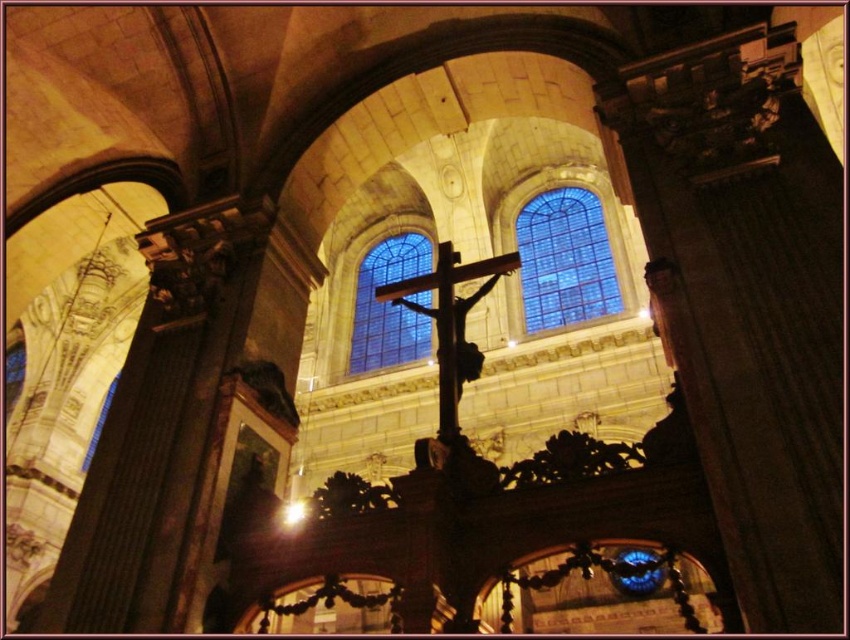
Question: Does blue stained glass at upper center appear on the right side of blue glass window at center?

Choices:
 (A) yes
 (B) no

Answer: (A)

Question: Can you confirm if blue stained glass at upper center is wider than metallic gold crucifix at center?

Choices:
 (A) no
 (B) yes

Answer: (A)

Question: Among these points, which one is nearest to the camera?

Choices:
 (A) (405, 333)
 (B) (588, 316)
 (C) (462, 278)

Answer: (C)

Question: Which of the following is the closest to the observer?

Choices:
 (A) (367, 362)
 (B) (581, 211)

Answer: (A)

Question: Does blue stained glass at upper center have a lesser width compared to metallic gold crucifix at center?

Choices:
 (A) no
 (B) yes

Answer: (B)

Question: Which object is positioned farthest from the blue glass window at center?

Choices:
 (A) metallic gold crucifix at center
 (B) blue stained glass at upper center

Answer: (B)